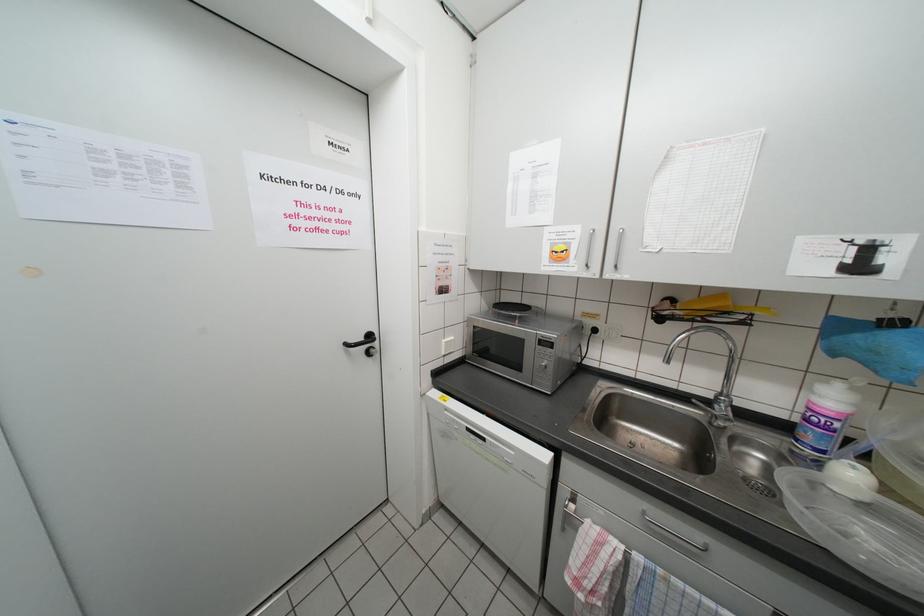
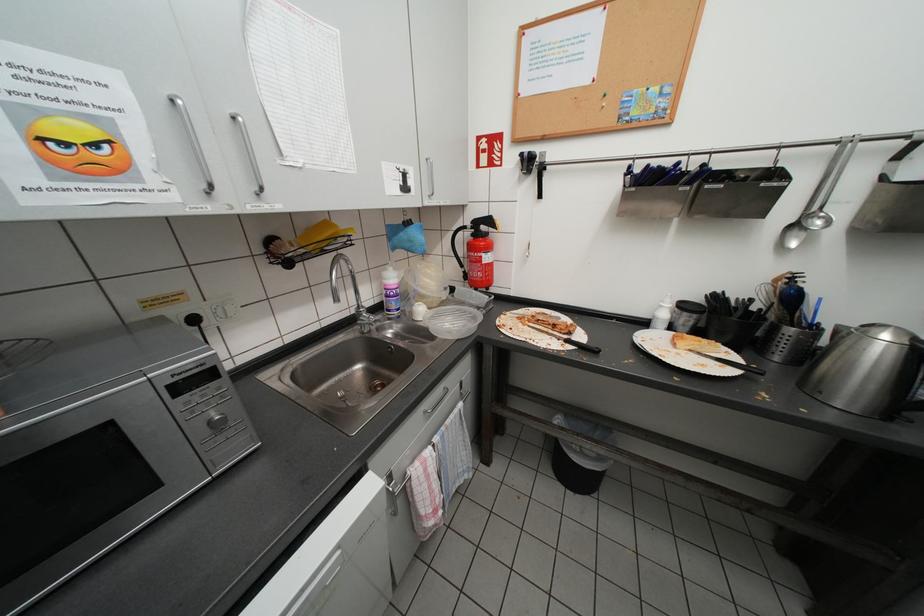
First-person continuous shooting, in which direction is the camera rotating?

The camera rotated toward right-down.